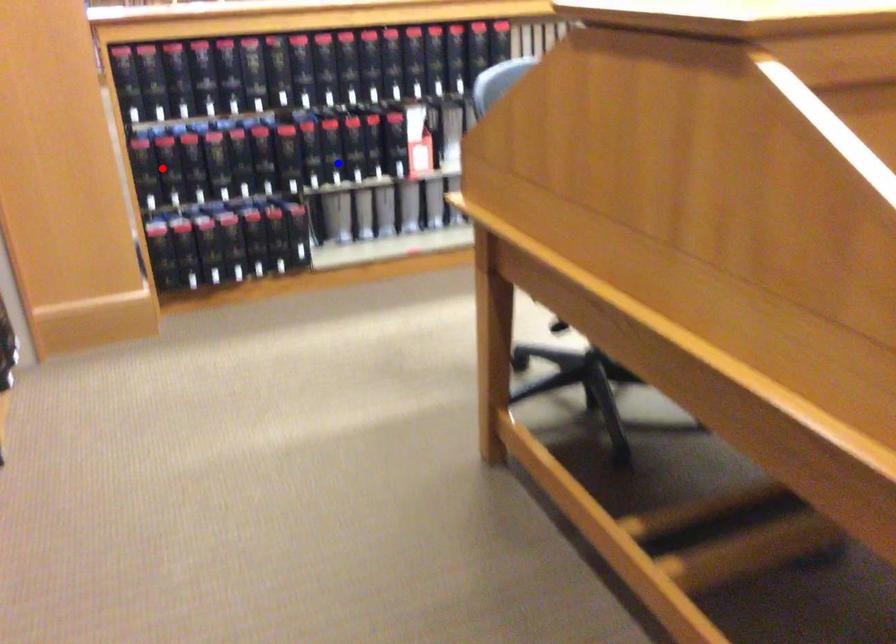
Question: Two points are marked on the image. Which point is closer to the camera?

Choices:
 (A) Blue point is closer.
 (B) Red point is closer.

Answer: (B)